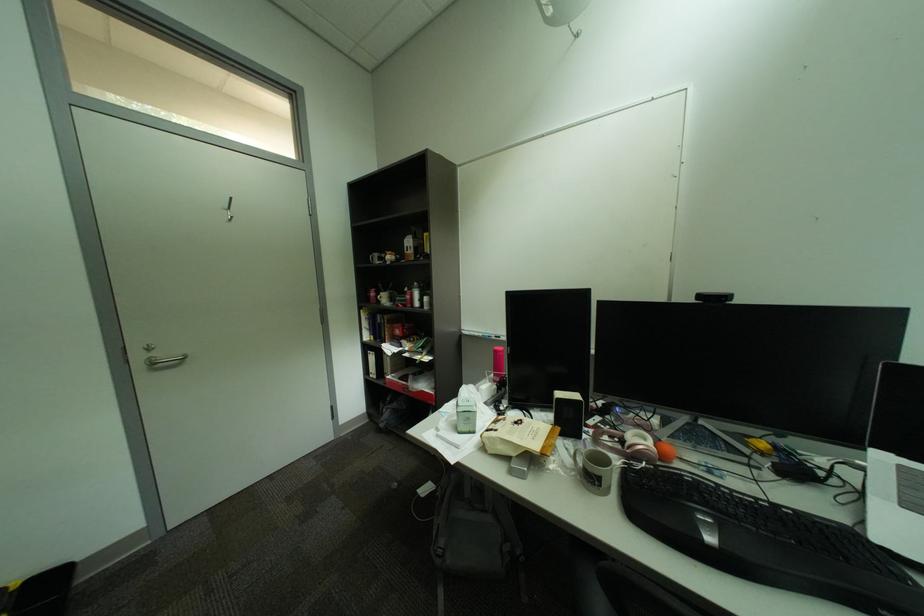
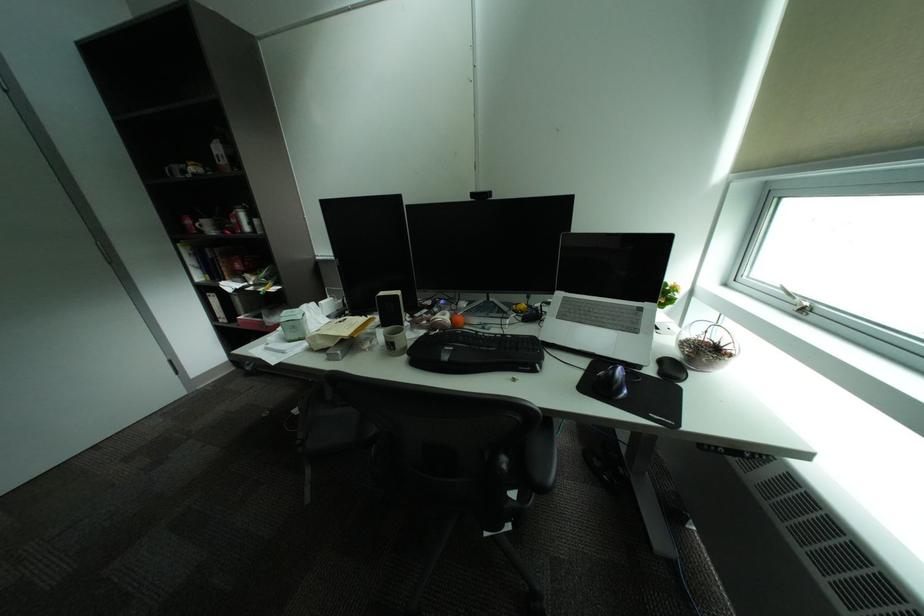
Question: The camera is either moving clockwise (left) or counter-clockwise (right) around the object. The first image is from the beginning of the video and the second image is from the end. Is the camera moving left or right when shooting the video?

Choices:
 (A) Left
 (B) Right

Answer: (A)